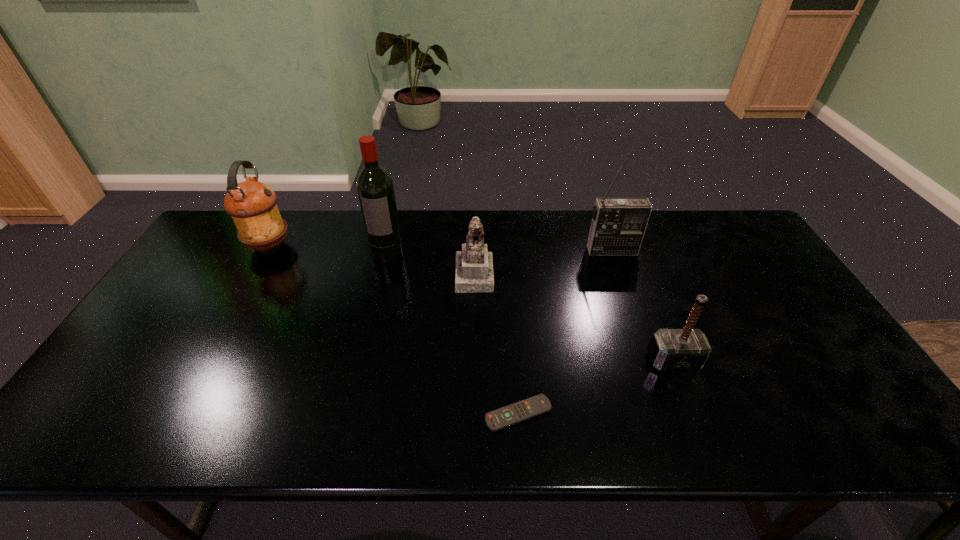
Where is `vacant point located on the front of the oil lamp`? vacant point located on the front of the oil lamp is located at coordinates (255, 272).

The image size is (960, 540). What are the coordinates of `vacant space situated on the left of the second nearest object` in the screenshot? It's located at (565, 360).

The width and height of the screenshot is (960, 540). What are the coordinates of `free space located 0.350m on the front-facing side of the figurine` in the screenshot? It's located at (608, 274).

The height and width of the screenshot is (540, 960). In order to click on free spot located 0.220m on the left of the shortest object in this screenshot , I will do `click(389, 414)`.

Find the location of a particular element. The width and height of the screenshot is (960, 540). wine bottle that is at the far edge is located at coordinates (375, 188).

At what (x,y) coordinates should I click in order to perform the action: click on radio receiver present at the far edge. Please return your answer as a coordinate pair (x, y). The height and width of the screenshot is (540, 960). Looking at the image, I should click on (618, 226).

The height and width of the screenshot is (540, 960). In order to click on oil lamp that is positioned at the far edge in this screenshot , I will do `click(252, 205)`.

At what (x,y) coordinates should I click in order to perform the action: click on object positioned at the near edge. Please return your answer as a coordinate pair (x, y). The height and width of the screenshot is (540, 960). Looking at the image, I should click on (501, 418).

At what (x,y) coordinates should I click in order to perform the action: click on object present at the left edge. Please return your answer as a coordinate pair (x, y). Image resolution: width=960 pixels, height=540 pixels. Looking at the image, I should click on (252, 205).

You are a GUI agent. You are given a task and a screenshot of the screen. Output one action in this format:
    pyautogui.click(x=<x>, y=<y>)
    Task: Click on the object located in the far left corner section of the desktop
    Image resolution: width=960 pixels, height=540 pixels.
    Given the screenshot: What is the action you would take?
    pos(252,205)